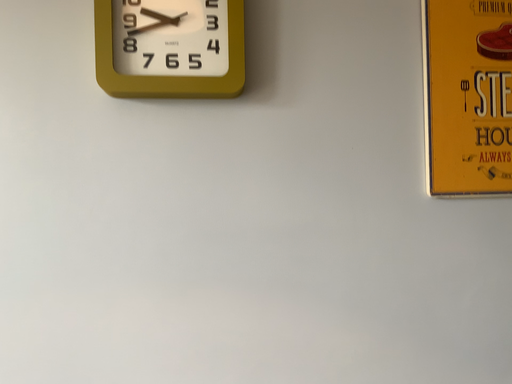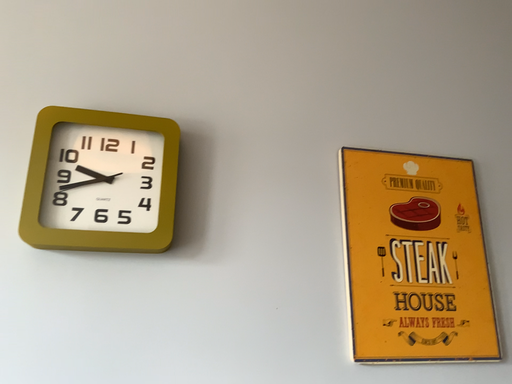
Question: How did the camera likely rotate when shooting the video?

Choices:
 (A) rotated right
 (B) rotated left

Answer: (A)